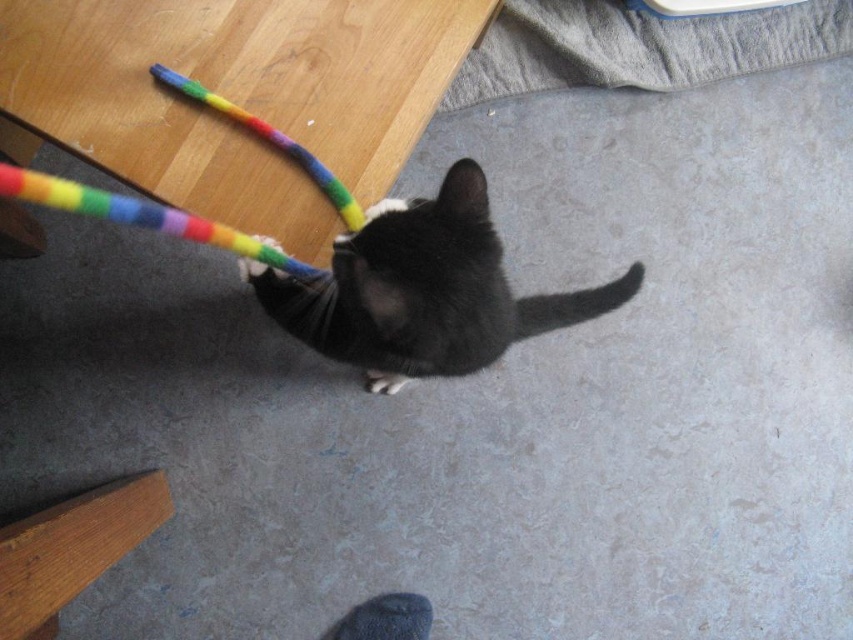
Is black matte fur cat at center bigger than soft gray fabric at upper center?

Yes, black matte fur cat at center is bigger than soft gray fabric at upper center.

I want to click on black matte fur cat at center, so click(422, 291).

Measure the distance between black matte fur cat at center and camera.

black matte fur cat at center and camera are 29.29 inches apart.

Locate an element on the screen. The image size is (853, 640). black matte fur cat at center is located at coordinates (422, 291).

Where is `black matte fur cat at center`? The width and height of the screenshot is (853, 640). black matte fur cat at center is located at coordinates (422, 291).

Between point (724, 64) and point (53, 179), which one is positioned behind?

The point (724, 64) is more distant.

Who is more distant from viewer, (x=576, y=70) or (x=252, y=250)?

The point (x=576, y=70) is more distant.

Locate an element on the screen. Image resolution: width=853 pixels, height=640 pixels. soft gray fabric at upper center is located at coordinates (639, 45).